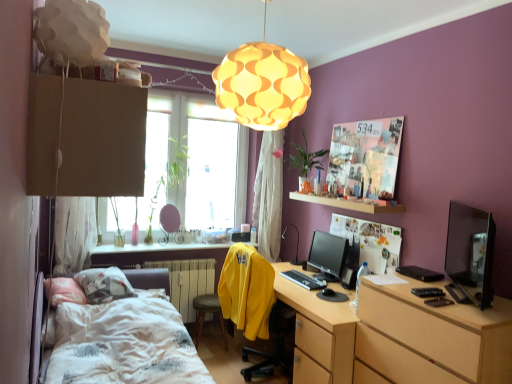
Question: From their relative heights in the image, would you say black glossy monitor at right is taller or shorter than black matte keyboard at center?

Choices:
 (A) short
 (B) tall

Answer: (B)

Question: Is point (466, 271) closer or farther from the camera than point (312, 281)?

Choices:
 (A) farther
 (B) closer

Answer: (B)

Question: Considering the real-world distances, which object is farthest from the matte black monitor at center?

Choices:
 (A) black glossy monitor at right
 (B) matte black table lamp at center
 (C) transparent glass window at center
 (D) matte paper poster at upper center, which is counted as the 1th poster page, starting from the bottom
 (E) white painted radiator at lower left

Answer: (C)

Question: Which object is the farthest from the matte paper poster at upper center, which is counted as the 1th poster page, starting from the bottom?

Choices:
 (A) white textured bed at lower left
 (B) light brown wood chest of drawers at right
 (C) white sheer curtain at left, positioned as the 2th curtain in right-to-left order
 (D) wooden at upper center
 (E) matte black table lamp at center

Answer: (C)